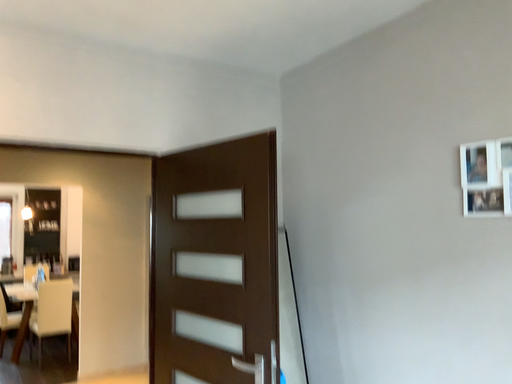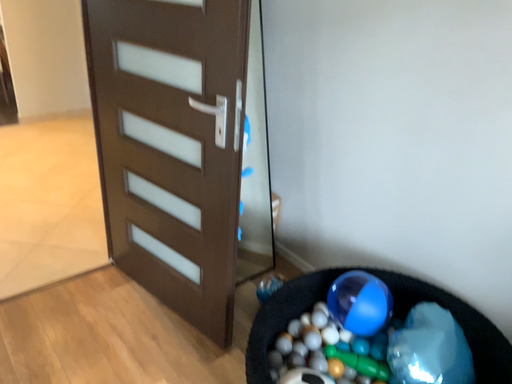
Question: Which way did the camera rotate in the video?

Choices:
 (A) rotated downward
 (B) rotated upward

Answer: (A)